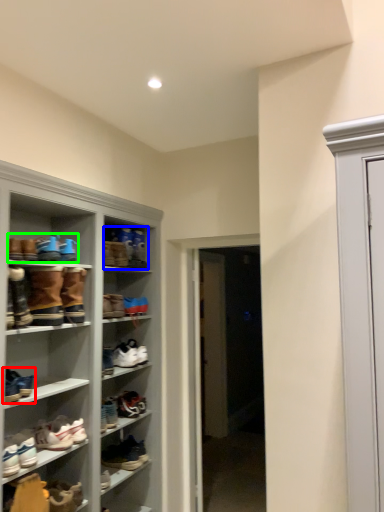
Question: Which object is the farthest from footwear (highlighted by a red box)? Choose among these: footwear (highlighted by a blue box) or footwear (highlighted by a green box).

Choices:
 (A) footwear
 (B) footwear

Answer: (A)